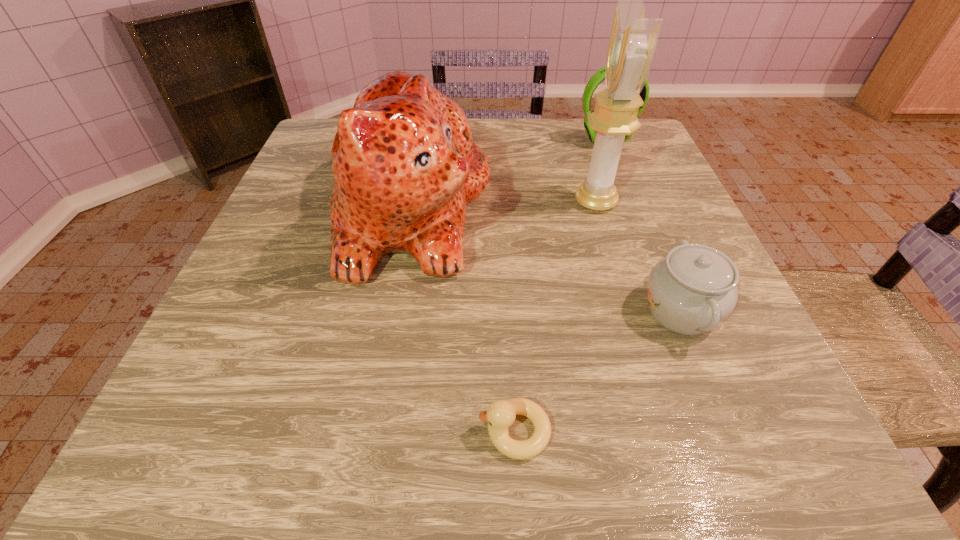
Where is `free space that satisfies the following two spatial constraints: 1. on the front-facing side of the chinaware; 2. on the right side of the award`? free space that satisfies the following two spatial constraints: 1. on the front-facing side of the chinaware; 2. on the right side of the award is located at coordinates (629, 311).

Locate an element on the screen. This screenshot has width=960, height=540. vacant space that satisfies the following two spatial constraints: 1. on the front side of the headset; 2. on the front-facing side of the award is located at coordinates (630, 202).